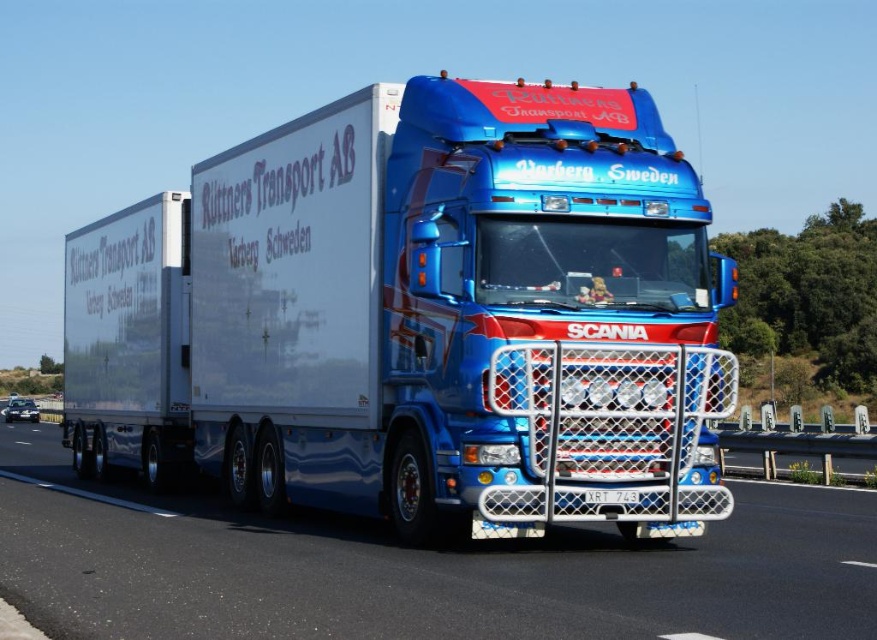
Based on the photo, you are a drone operator flying a drone that is 1.5 meters in height. You want to fly the drone between the shiny metallic trailer truck at center and the metallic asphalt road at center. Is there enough vertical space for the drone to pass through?

The distance between the shiny metallic trailer truck at center and the metallic asphalt road at center is 2.16 meters. Since the drone is 1.5 meters tall, there is sufficient vertical clearance for it to pass through.

You are a traffic officer observing a vehicle on the highway. You notice the shiny metallic trailer truck at center and the white plastic license plate at center. Which object is positioned to the left from your viewpoint?

The shiny metallic trailer truck at center is to the left of the white plastic license plate at center from your viewpoint.